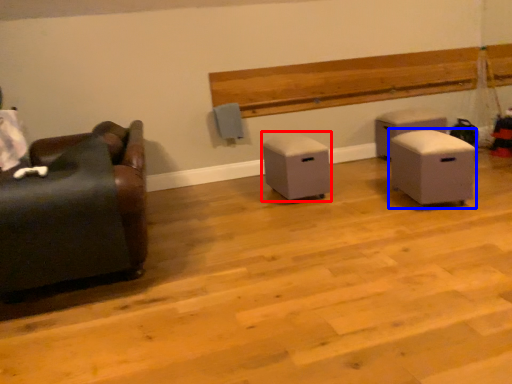
Question: Which of the following is the farthest to the observer, furniture (highlighted by a red box) or furniture (highlighted by a blue box)?

Choices:
 (A) furniture
 (B) furniture

Answer: (A)